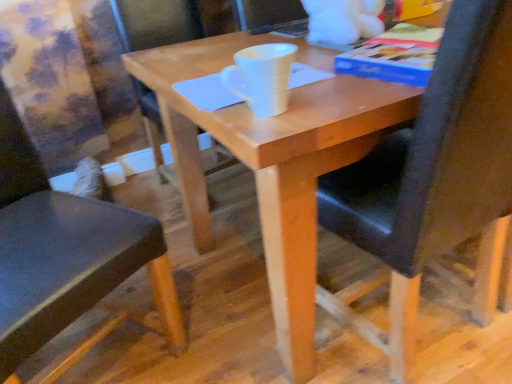
You are a GUI agent. You are given a task and a screenshot of the screen. Output one action in this format:
    pyautogui.click(x=<x>, y=<y>)
    Task: Click on the free space to the right of white matte mug at center
    
    Given the screenshot: What is the action you would take?
    pyautogui.click(x=338, y=91)